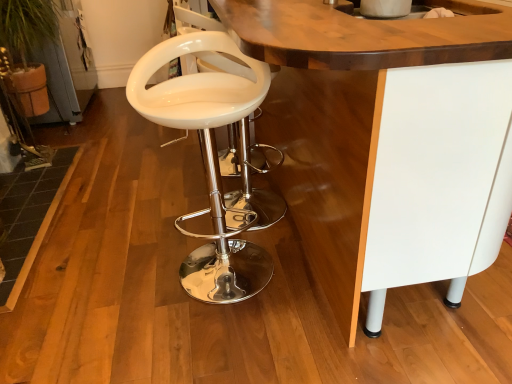
This screenshot has height=384, width=512. Identify the location of free point behind white glossy bar stool at center. (x=212, y=210).